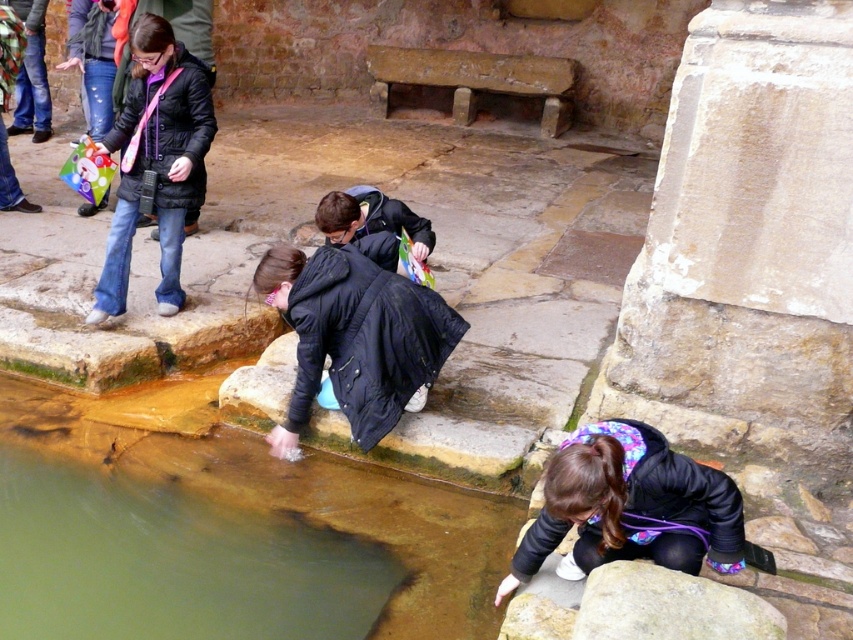
You are standing at the origin point of the image. You want to move towards the point labeled as point (434, 566). However, there is an obstacle at point (624, 561). Will you collide with the obstacle before reaching your destination?

Since point (434, 566) is behind point (624, 561), you will collide with the obstacle at point (624, 561) before reaching your destination.

You are a tour guide at this historical site and need to ensure visitors follow the rule that no clothing items can be placed in the water. You notice two jackets in the scene. Which jacket, the black matte jacket at center or the matte black jacket at upper left, is positioned closer to the water in the pool?

The black matte jacket at center is located below the matte black jacket at upper left, meaning it is closer to the water in the pool.